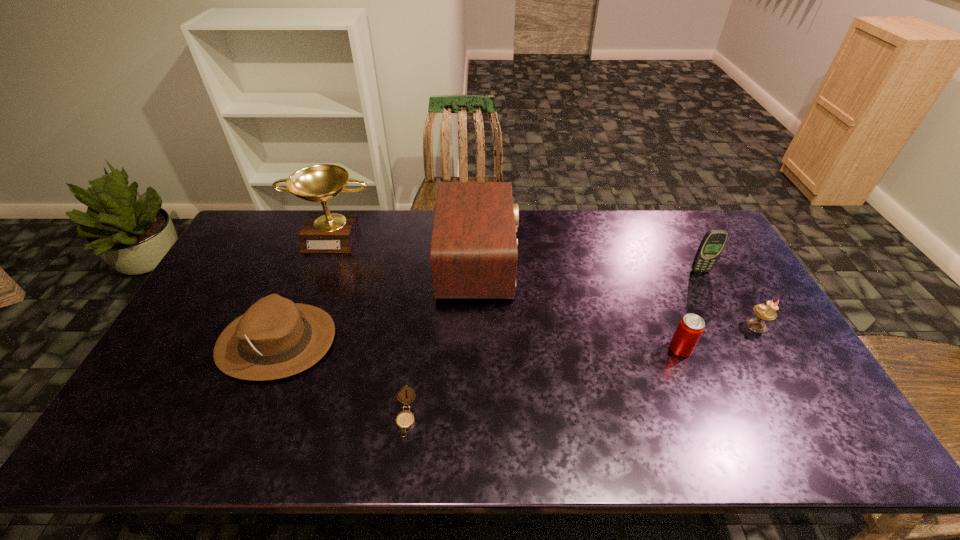
Locate an element on the screen. This screenshot has width=960, height=540. free space at the far edge is located at coordinates (581, 235).

In the image, there is a desktop. In order to click on vacant space at the near edge in this screenshot , I will do `click(397, 446)`.

The height and width of the screenshot is (540, 960). I want to click on free space at the left edge, so click(x=251, y=289).

Where is `free space at the right edge of the desktop`? This screenshot has width=960, height=540. free space at the right edge of the desktop is located at coordinates (755, 295).

Image resolution: width=960 pixels, height=540 pixels. Find the location of `vacant area at the near right corner`. vacant area at the near right corner is located at coordinates (833, 424).

Find the location of `free space between the can and the fifth object from right to left`. free space between the can and the fifth object from right to left is located at coordinates (543, 383).

What are the coordinates of `vacant space that is in between the third object from right to left and the fedora` in the screenshot? It's located at (479, 345).

Image resolution: width=960 pixels, height=540 pixels. I want to click on free space that is in between the nearest object and the second object from right to left, so click(553, 345).

Find the location of a particular element. This screenshot has width=960, height=540. empty space that is in between the fedora and the candle holder is located at coordinates (516, 334).

Image resolution: width=960 pixels, height=540 pixels. Identify the location of vacant area that lies between the fifth object from left to right and the fifth object from right to left. (543, 383).